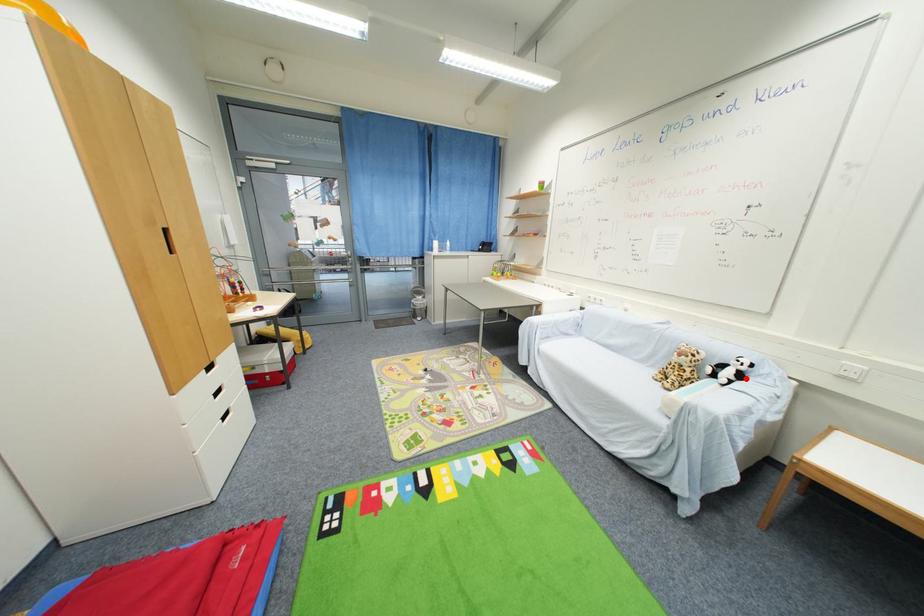
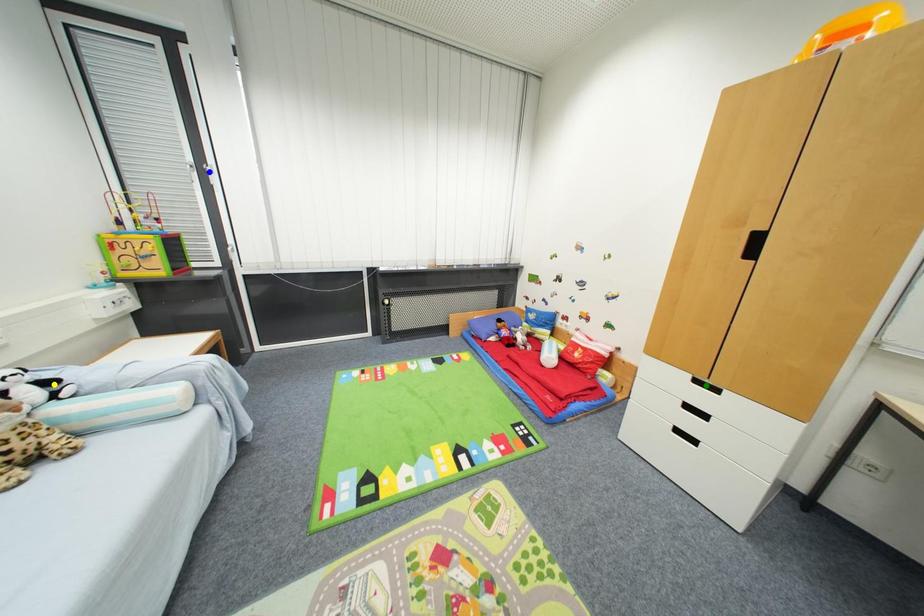
Question: I am providing you with two images of the same scene from different viewpoints. A red point is marked on the first image. You are given multiple points on the second image. Which mark in image 2 goes with the point in image 1?

Choices:
 (A) yellow point
 (B) green point
 (C) blue point

Answer: (A)